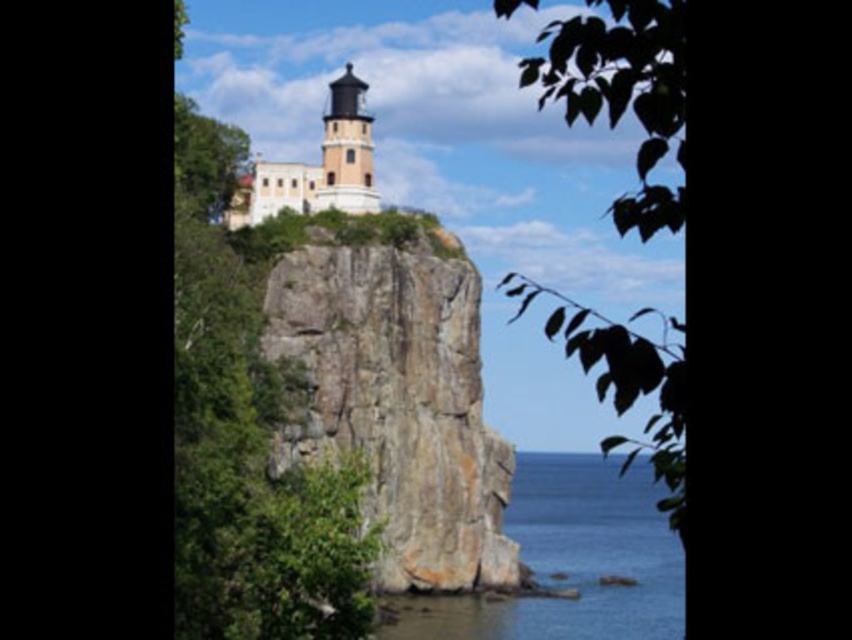
Between green leafy tree at upper center and white stone tower at upper center, which one is positioned lower?

green leafy tree at upper center

Identify the location of green leafy tree at upper center. (623, 92).

I want to click on green leafy tree at upper center, so click(x=623, y=92).

Who is positioned more to the right, green leafy tree at upper left or white stone tower at upper center?

From the viewer's perspective, white stone tower at upper center appears more on the right side.

Can you confirm if green leafy tree at upper left is taller than white stone tower at upper center?

Correct, green leafy tree at upper left is much taller as white stone tower at upper center.

Is point (269, 385) positioned behind point (286, 179)?

That is False.

Find the location of a particular element. green leafy tree at upper left is located at coordinates (248, 433).

Can you confirm if rocky cliff at center is smaller than white textured lighthouse at center?

Incorrect, rocky cliff at center is not smaller in size than white textured lighthouse at center.

Is rocky cliff at center thinner than white textured lighthouse at center?

No, rocky cliff at center is not thinner than white textured lighthouse at center.

Is point (308, 241) farther from viewer compared to point (320, 204)?

No, (308, 241) is in front of (320, 204).

Where is `rocky cliff at center`? rocky cliff at center is located at coordinates (396, 392).